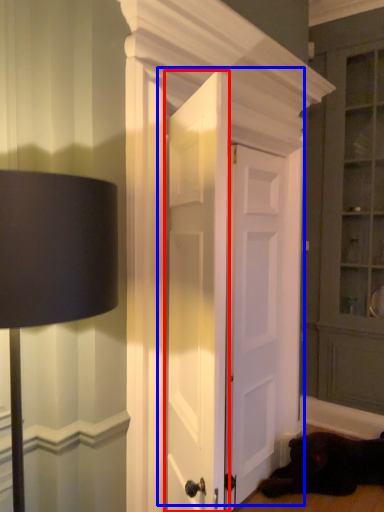
Question: Which object is closer to the camera taking this photo, door (highlighted by a red box) or door (highlighted by a blue box)?

Choices:
 (A) door
 (B) door

Answer: (A)